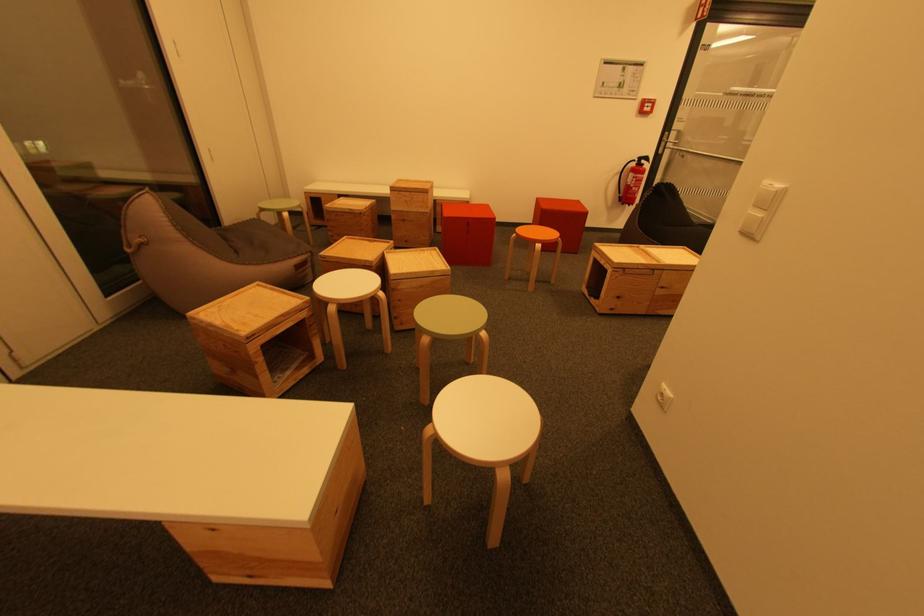
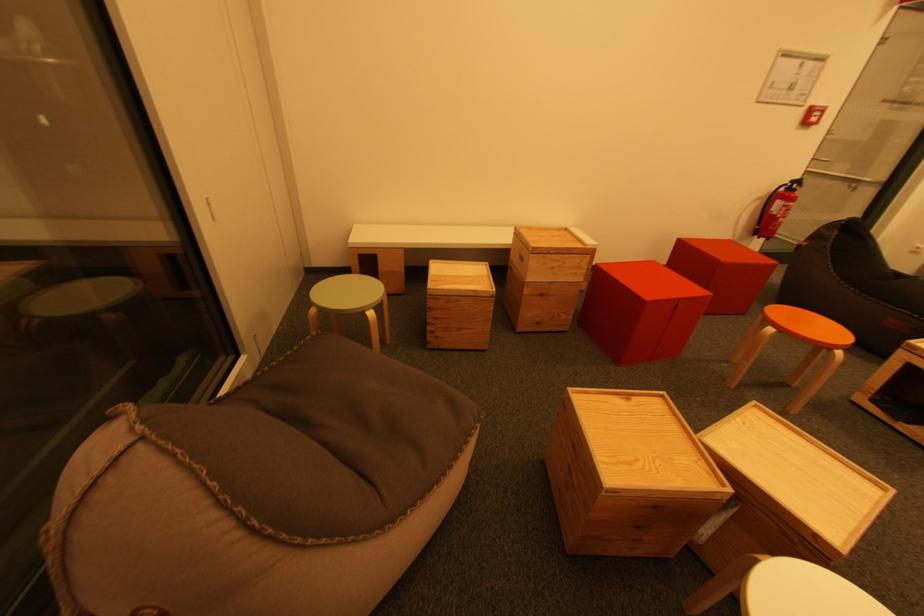
Which direction would the cameraman need to move to produce the second image?

The cameraman moved toward left, forward.